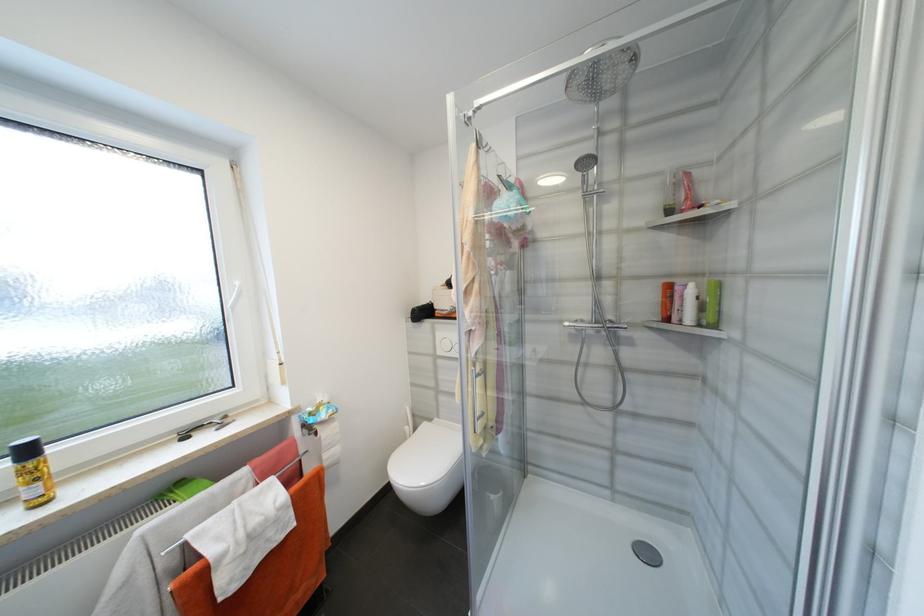
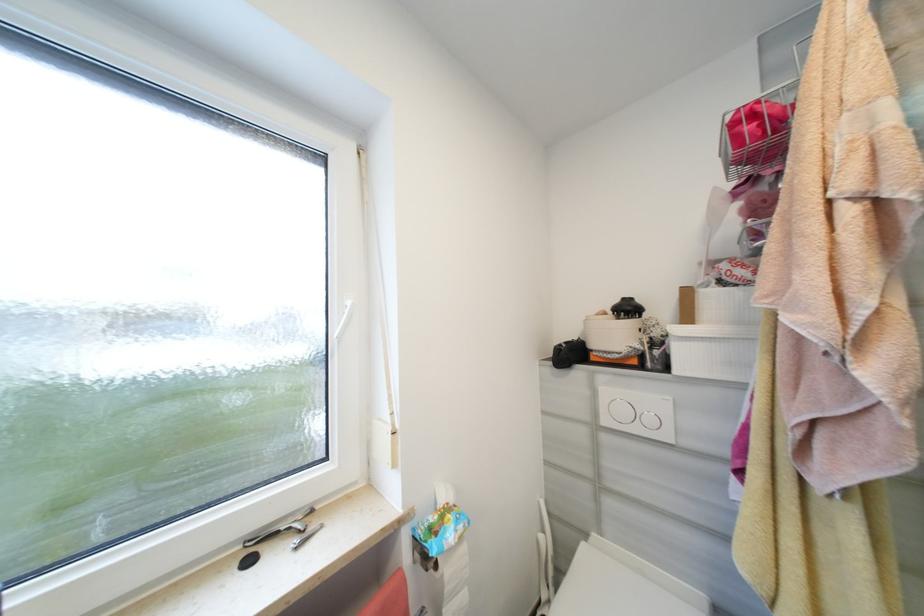
Which direction would the cameraman need to move to produce the second image?

The cameraman moved toward left, forward.